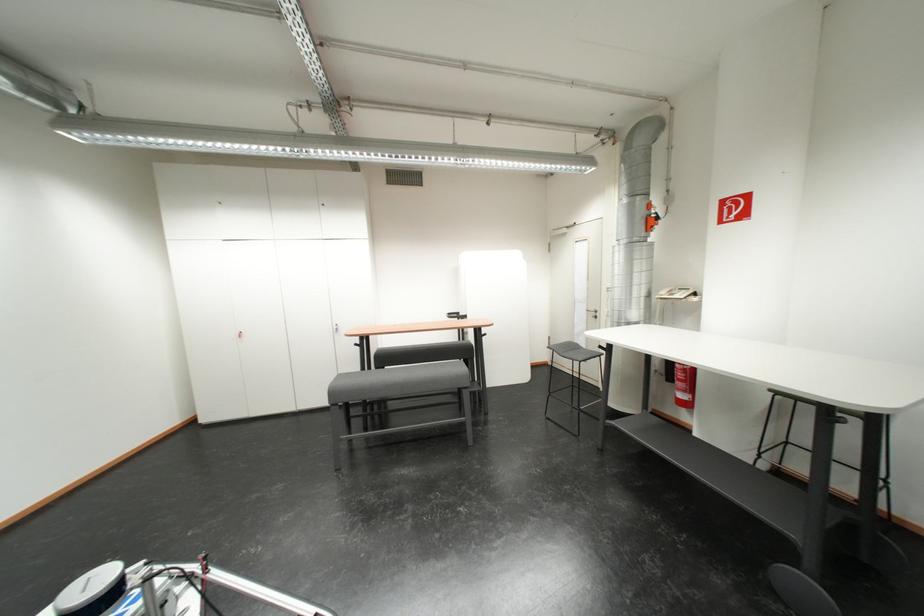
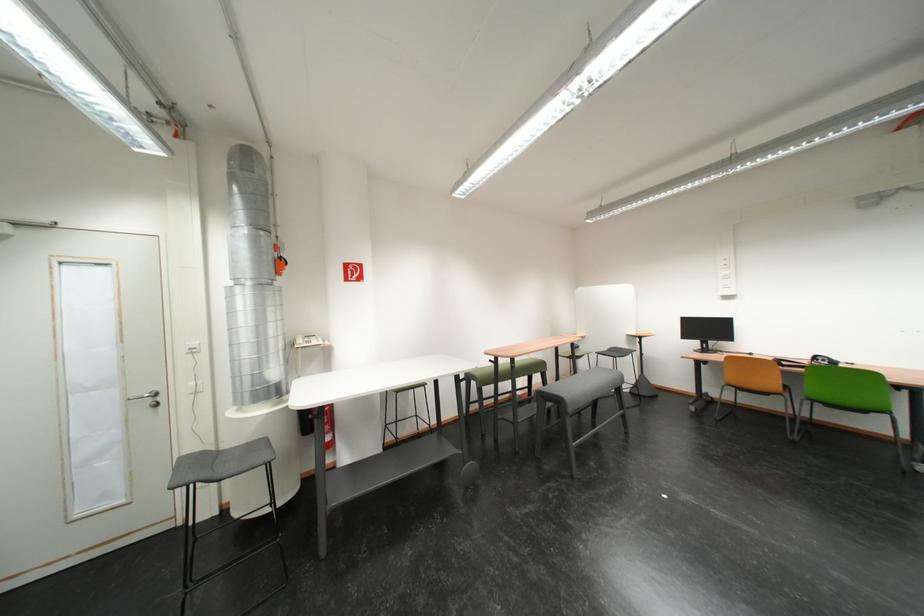
Where in the second image is the point corresponding to (654,224) from the first image?

(284, 265)